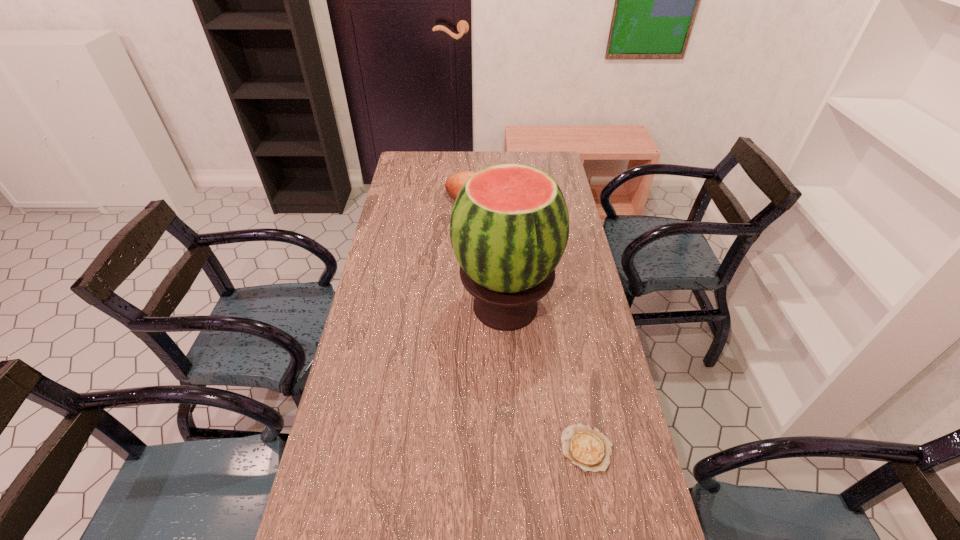
Where is `empty location between the bread and the shortest object`? empty location between the bread and the shortest object is located at coordinates (534, 327).

Select which object is the closest to the watermelon. Please provide its 2D coordinates. Your answer should be formatted as a tuple, i.e. [(x, y)], where the tuple contains the x and y coordinates of a point satisfying the conditions above.

[(454, 183)]

Locate which object is the second closest to the tallest object. Please provide its 2D coordinates. Your answer should be formatted as a tuple, i.e. [(x, y)], where the tuple contains the x and y coordinates of a point satisfying the conditions above.

[(587, 447)]

Where is `free location that satisfies the following two spatial constraints: 1. on the front side of the tallest object; 2. on the left side of the bread`? free location that satisfies the following two spatial constraints: 1. on the front side of the tallest object; 2. on the left side of the bread is located at coordinates (479, 307).

You are a GUI agent. You are given a task and a screenshot of the screen. Output one action in this format:
    pyautogui.click(x=<x>, y=<y>)
    Task: Click on the vacant space that satisfies the following two spatial constraints: 1. on the front side of the bread; 2. on the left side of the second farthest object
    
    Given the screenshot: What is the action you would take?
    pyautogui.click(x=479, y=307)

You are a GUI agent. You are given a task and a screenshot of the screen. Output one action in this format:
    pyautogui.click(x=<x>, y=<y>)
    Task: Click on the free space that satisfies the following two spatial constraints: 1. on the front side of the nearest object; 2. on the right side of the watermelon
    This screenshot has height=540, width=960.
    Given the screenshot: What is the action you would take?
    pyautogui.click(x=513, y=448)

Identify the location of vacant area that satisfies the following two spatial constraints: 1. on the front side of the watermelon; 2. on the right side of the shortest object. The width and height of the screenshot is (960, 540). (513, 448).